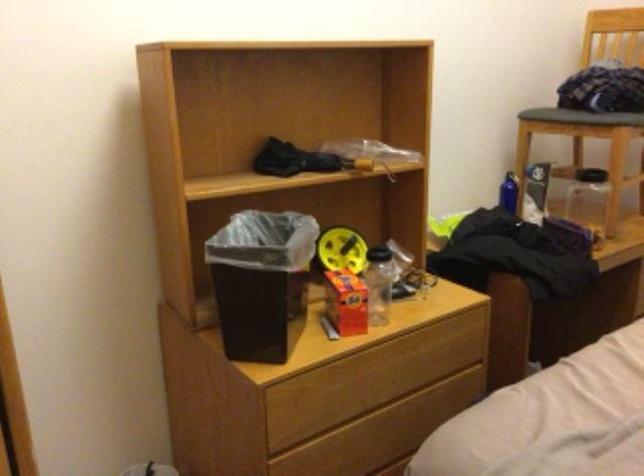
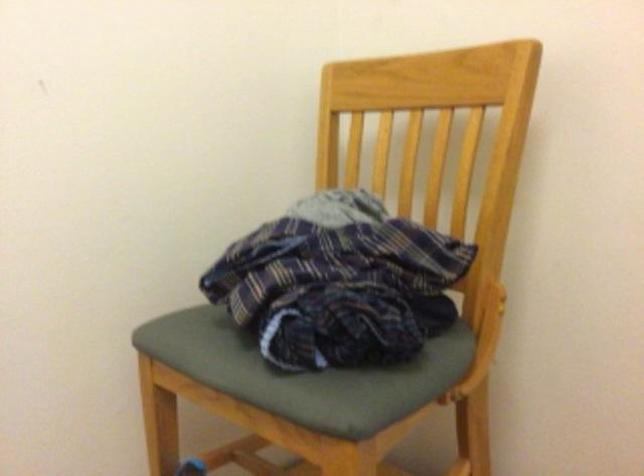
In the scene shown: In a continuous first-person perspective shot, in which direction is the camera moving?

The cameraman walked toward right, forward.